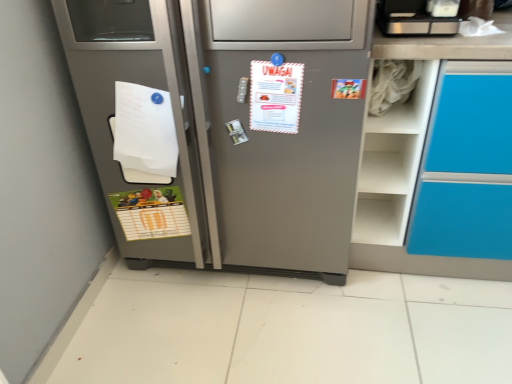
Question: Is brushed metal toaster at upper right bigger than green matte postcard at lower left, arranged as the first postcard when viewed from the back?

Choices:
 (A) yes
 (B) no

Answer: (A)

Question: Is the depth of brushed metal toaster at upper right greater than that of green matte postcard at lower left, which appears as the second postcard when viewed from the front?

Choices:
 (A) yes
 (B) no

Answer: (B)

Question: Considering the relative positions of brushed metal toaster at upper right and green matte postcard at lower left, arranged as the 2th postcard when viewed from the top, in the image provided, is brushed metal toaster at upper right to the left of green matte postcard at lower left, arranged as the 2th postcard when viewed from the top, from the viewer's perspective?

Choices:
 (A) yes
 (B) no

Answer: (B)

Question: Is brushed metal toaster at upper right facing towards green matte postcard at lower left, which ranks as the first postcard in bottom-to-top order?

Choices:
 (A) yes
 (B) no

Answer: (B)

Question: Does brushed metal toaster at upper right have a greater width compared to green matte postcard at lower left, arranged as the first postcard when viewed from the back?

Choices:
 (A) no
 (B) yes

Answer: (B)

Question: Choose the correct answer: Is white paper at left inside satin silver refrigerator at center or outside it?

Choices:
 (A) inside
 (B) outside

Answer: (A)

Question: Is white paper at left wider or thinner than satin silver refrigerator at center?

Choices:
 (A) thin
 (B) wide

Answer: (A)

Question: From the image's perspective, is white paper at left positioned above or below satin silver refrigerator at center?

Choices:
 (A) above
 (B) below

Answer: (B)

Question: From a real-world perspective, relative to satin silver refrigerator at center, is white paper at left vertically above or below?

Choices:
 (A) below
 (B) above

Answer: (B)

Question: Do you think white paper at center, which is the 2th postcard in back-to-front order, is within white matte shelf at upper right, or outside of it?

Choices:
 (A) outside
 (B) inside

Answer: (A)

Question: Looking at their shapes, would you say white paper at center, the second postcard when ordered from bottom to top, is wider or thinner than white matte shelf at upper right?

Choices:
 (A) thin
 (B) wide

Answer: (A)

Question: Relative to white matte shelf at upper right, is white paper at center, which is the 2th postcard in back-to-front order, in front or behind?

Choices:
 (A) front
 (B) behind

Answer: (A)

Question: Is white paper at center, placed as the first postcard when sorted from front to back, taller or shorter than white matte shelf at upper right?

Choices:
 (A) short
 (B) tall

Answer: (B)

Question: Based on their positions, is green matte postcard at lower left, which is the 2th postcard from right to left, located to the left or right of white matte shelf at upper right?

Choices:
 (A) right
 (B) left

Answer: (B)

Question: From a real-world perspective, relative to white matte shelf at upper right, is green matte postcard at lower left, arranged as the first postcard when viewed from the back, vertically above or below?

Choices:
 (A) above
 (B) below

Answer: (B)